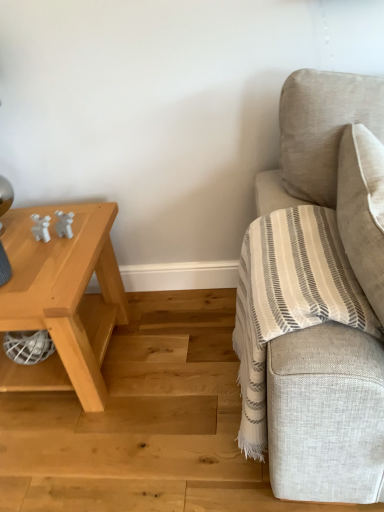
Question: Does light wood table at left have a lesser width compared to natural wood stair at lower right?

Choices:
 (A) yes
 (B) no

Answer: (A)

Question: Is natural wood stair at lower right completely or partially inside light wood table at left?

Choices:
 (A) no
 (B) yes

Answer: (A)

Question: Considering the relative sizes of light wood table at left and natural wood stair at lower right in the image provided, is light wood table at left bigger than natural wood stair at lower right?

Choices:
 (A) yes
 (B) no

Answer: (A)

Question: From a real-world perspective, is light wood table at left on natural wood stair at lower right?

Choices:
 (A) no
 (B) yes

Answer: (B)

Question: Is light wood table at left closer to the viewer compared to natural wood stair at lower right?

Choices:
 (A) yes
 (B) no

Answer: (B)

Question: Do you think natural wood stair at lower right is within beige fabric couch at right, or outside of it?

Choices:
 (A) inside
 (B) outside

Answer: (B)

Question: Is point (61, 483) closer or farther from the camera than point (352, 350)?

Choices:
 (A) farther
 (B) closer

Answer: (A)

Question: From a real-world perspective, relative to beige fabric couch at right, is natural wood stair at lower right vertically above or below?

Choices:
 (A) above
 (B) below

Answer: (B)

Question: From the image's perspective, is natural wood stair at lower right located above or below beige fabric couch at right?

Choices:
 (A) above
 (B) below

Answer: (B)

Question: Considering the positions of point (309, 332) and point (119, 438), is point (309, 332) closer or farther from the camera than point (119, 438)?

Choices:
 (A) closer
 (B) farther

Answer: (A)

Question: Based on their sizes in the image, would you say beige fabric couch at right is bigger or smaller than natural wood stair at lower right?

Choices:
 (A) big
 (B) small

Answer: (A)

Question: Which is correct: beige fabric couch at right is inside natural wood stair at lower right, or outside of it?

Choices:
 (A) inside
 (B) outside

Answer: (B)

Question: From the image's perspective, is beige fabric couch at right positioned above or below natural wood stair at lower right?

Choices:
 (A) below
 (B) above

Answer: (B)

Question: Does point (61, 247) appear closer or farther from the camera than point (18, 452)?

Choices:
 (A) farther
 (B) closer

Answer: (B)

Question: From the image's perspective, is light wood table at left above or below natural wood stair at lower right?

Choices:
 (A) above
 (B) below

Answer: (A)